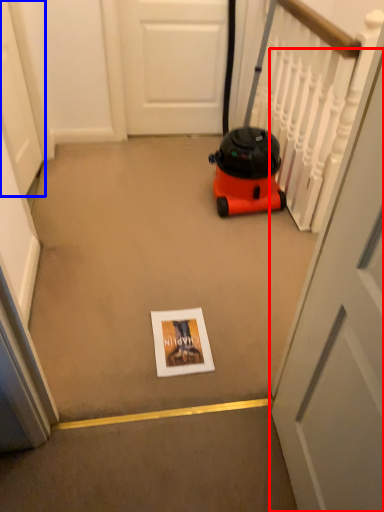
Question: Among these objects, which one is nearest to the camera, door (highlighted by a red box) or door (highlighted by a blue box)?

Choices:
 (A) door
 (B) door

Answer: (A)